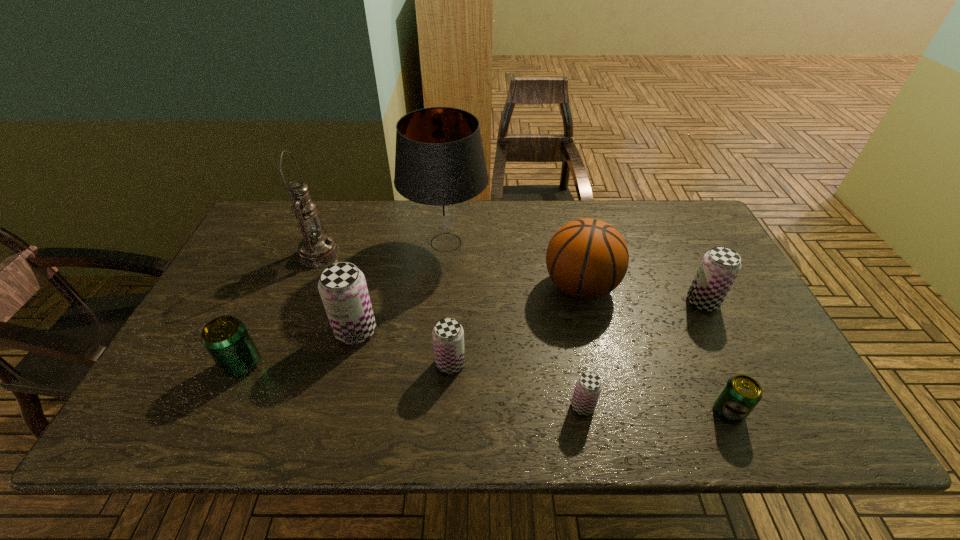
In the image, there is a desktop. Where is `vacant area at the left edge`? vacant area at the left edge is located at coordinates (250, 253).

What are the coordinates of `free space at the right edge of the desktop` in the screenshot? It's located at (682, 265).

The image size is (960, 540). I want to click on empty location between the gray lampshade and the leftmost purple beer can, so click(401, 287).

Locate an element on the screen. This screenshot has height=540, width=960. free space between the right green beer can and the lampshade is located at coordinates 588,327.

In order to click on vacant area that lies between the smaller green beer can and the fifth shortest beer can in this screenshot , I will do `click(715, 356)`.

This screenshot has height=540, width=960. What are the coordinates of `unoccupied position between the fourth beer can from right to left and the brown basketball` in the screenshot? It's located at (516, 325).

Identify the location of blank region between the second farthest purple beer can and the basketball. (468, 309).

The height and width of the screenshot is (540, 960). In order to click on vacant region between the rightmost purple beer can and the fifth nearest beer can in this screenshot , I will do `click(529, 316)`.

This screenshot has height=540, width=960. What are the coordinates of `vacant area between the second purple beer can from right to left and the rightmost purple beer can` in the screenshot? It's located at (643, 354).

Locate an element on the screen. The width and height of the screenshot is (960, 540). empty location between the smaller green beer can and the fourth beer can from left to right is located at coordinates [656, 409].